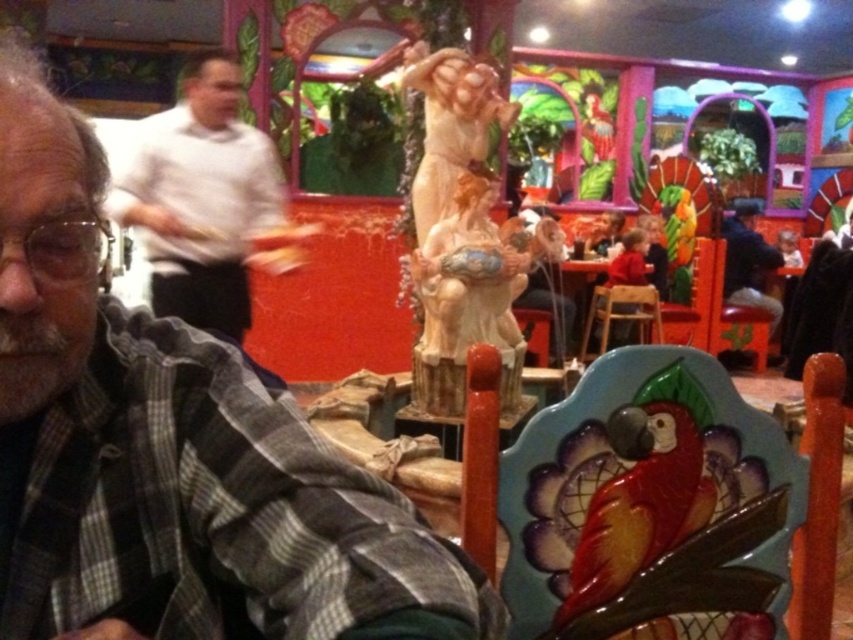
This screenshot has height=640, width=853. What do you see at coordinates (172, 451) in the screenshot? I see `plaid shirt at center` at bounding box center [172, 451].

Does point (296, 474) come closer to viewer compared to point (445, 65)?

Yes, it is in front of point (445, 65).

The width and height of the screenshot is (853, 640). I want to click on plaid shirt at center, so click(x=172, y=451).

Between plaid shirt at center and white shirt at upper left, which one is positioned higher?

white shirt at upper left is higher up.

Can you confirm if plaid shirt at center is positioned above white shirt at upper left?

Incorrect, plaid shirt at center is not positioned above white shirt at upper left.

Identify the location of plaid shirt at center. (172, 451).

Consider the image. Who is positioned more to the right, white shirt at upper left or matte ceramic statue at center?

Positioned to the right is matte ceramic statue at center.

Who is more forward, (186, 214) or (428, 148)?

Positioned in front is point (428, 148).

The height and width of the screenshot is (640, 853). Find the location of `white shirt at upper left`. white shirt at upper left is located at coordinates (206, 200).